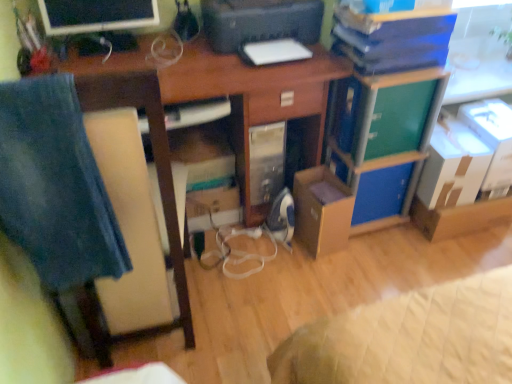
Question: Considering the positions of point (497, 137) and point (155, 104), is point (497, 137) closer or farther from the camera than point (155, 104)?

Choices:
 (A) farther
 (B) closer

Answer: (A)

Question: From a real-world perspective, is white cardboard box at upper right, the fourth cardboard box from the left, physically located above or below wooden chair at left?

Choices:
 (A) above
 (B) below

Answer: (B)

Question: Considering the real-world distances, which object is farthest from the white cardboard box at upper right, which ranks as the first cardboard box in right-to-left order?

Choices:
 (A) white cardboard box at right, the third cardboard box in the right-to-left sequence
 (B) brown cardboard box at center, which appears as the 4th cardboard box when viewed from the right
 (C) wooden chair at left
 (D) brown cardboard box at lower right, which is the 3th cardboard box in left-to-right order
 (E) blue cardboard box at center-right

Answer: (C)

Question: Which object is the closest to the matte black monitor at upper left?

Choices:
 (A) white cardboard box at right, the third cardboard box in the right-to-left sequence
 (B) green plastic drawer at center-right
 (C) wooden chair at left
 (D) black plastic printer at upper center
 (E) white cardboard box at upper right, the fourth cardboard box from the left

Answer: (D)